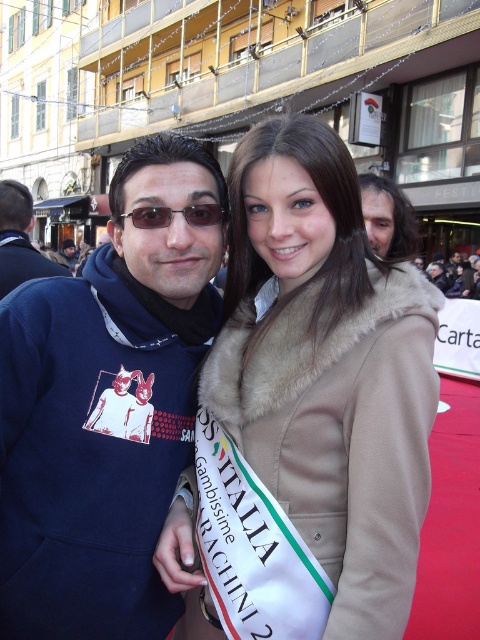
Does matte blue hoodie at left have a larger size compared to matte black sunglasses at center?

Yes.

Does matte blue hoodie at left appear on the right side of matte black sunglasses at center?

No, matte blue hoodie at left is not to the right of matte black sunglasses at center.

Where is `matte blue hoodie at left`? This screenshot has width=480, height=640. matte blue hoodie at left is located at coordinates (20, 241).

Based on the photo, which is above, navy blue hoodie at left or matte blue hoodie at left?

matte blue hoodie at left is above.

This screenshot has height=640, width=480. I want to click on navy blue hoodie at left, so click(x=106, y=408).

Where is `navy blue hoodie at left`? This screenshot has height=640, width=480. navy blue hoodie at left is located at coordinates (106, 408).

Does beige fur coat at center appear on the left side of matte blue hoodie at left?

In fact, beige fur coat at center is to the right of matte blue hoodie at left.

Can you confirm if beige fur coat at center is wider than matte blue hoodie at left?

In fact, beige fur coat at center might be narrower than matte blue hoodie at left.

Is point (264, 209) closer to camera compared to point (16, 180)?

That is True.

Find the location of a particular element. beige fur coat at center is located at coordinates coord(305,412).